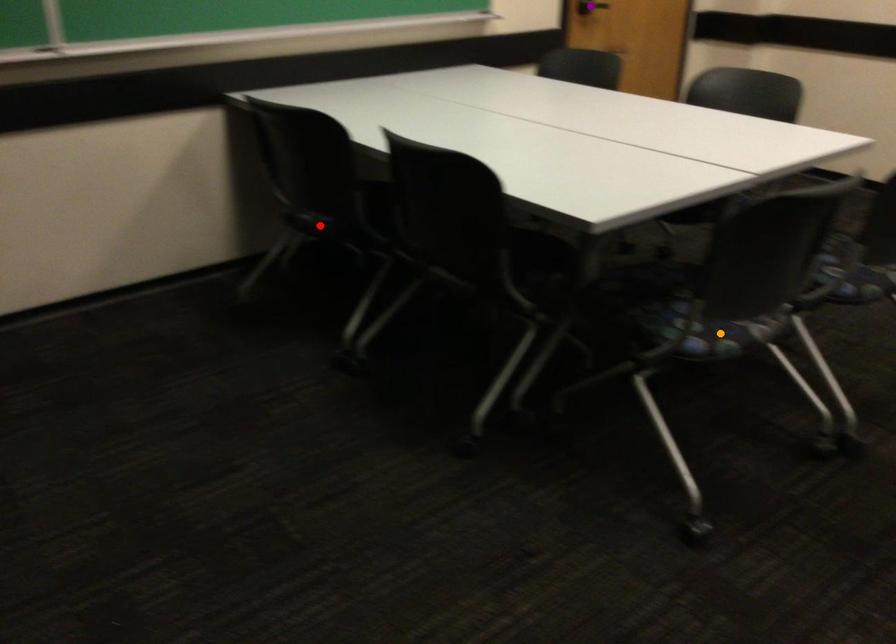
Consider the image. Order these from nearest to farthest:
orange point | purple point | red point

orange point < red point < purple point